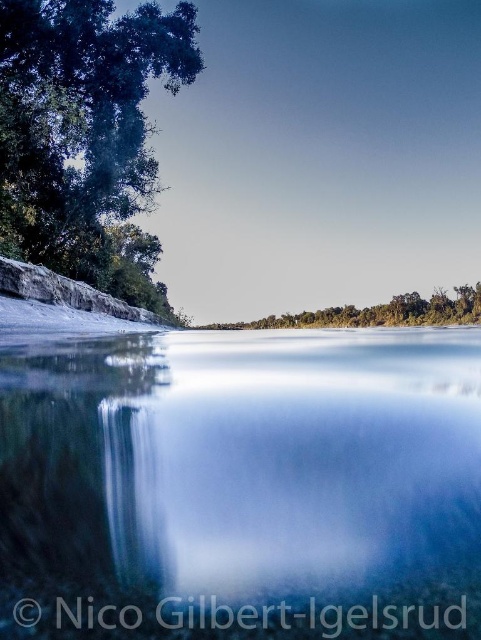
You are an environmental scientist assessing the water quality in this scene. You notice the clear glass water at center and the green leafy tree at upper left. Which object is shorter in height?

The clear glass water at center has a lesser height compared to the green leafy tree at upper left, so the clear glass water at center is shorter in height.

You are standing at the center of the image and want to locate the green leafy tree at upper left. In which direction should you look to find it?

The green leafy tree at upper left is located at point coordinates indicating it is in the upper left direction from your current position at the center of the image.